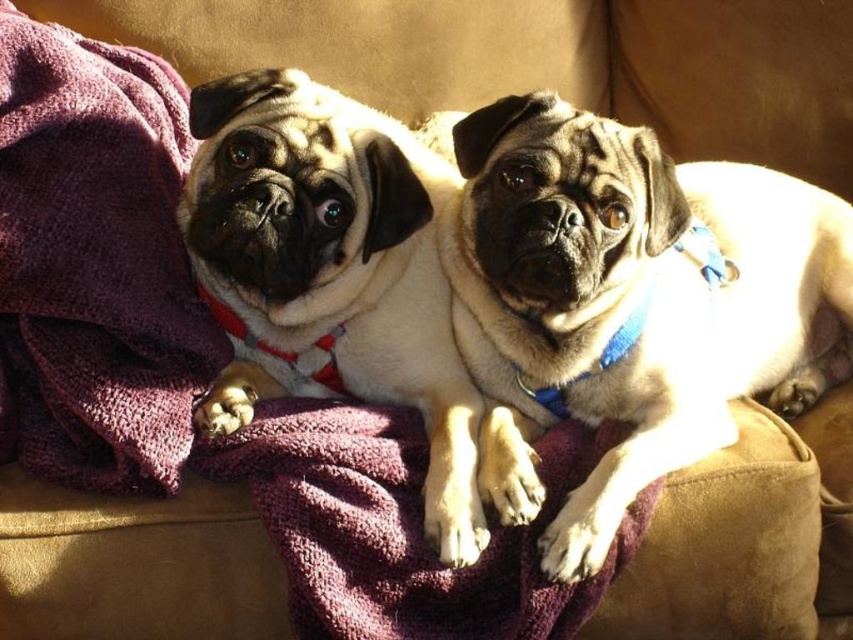
Question: Is matte beige pug at center to the right of purple soft towel at left from the viewer's perspective?

Choices:
 (A) no
 (B) yes

Answer: (B)

Question: Which of the following is the farthest from the observer?

Choices:
 (A) purple soft towel at left
 (B) smooth beige dog at center

Answer: (A)

Question: Which of the following is the closest to the observer?

Choices:
 (A) (573, 376)
 (B) (247, 234)
 (C) (152, 160)

Answer: (B)

Question: Is smooth beige dog at center above purple soft towel at left?

Choices:
 (A) yes
 (B) no

Answer: (B)

Question: Which object appears closest to the camera in this image?

Choices:
 (A) purple soft towel at left
 (B) matte beige pug at center

Answer: (B)

Question: Is matte beige pug at center to the right of purple soft towel at left from the viewer's perspective?

Choices:
 (A) yes
 (B) no

Answer: (A)